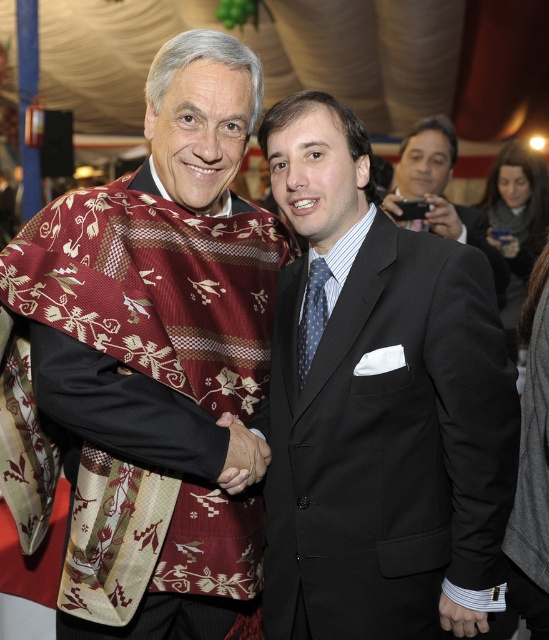
Based on the photo, you are an event photographer at the formal event. You need to capture a photo of the maroon woven shawl at center and the dark gray suit at center. Which one is located lower in the image?

The maroon woven shawl at center is positioned under dark gray suit at center, so it is located lower in the image.

You are a photographer standing at the camera position. You need to take a photo of the two people shaking hands. The focus point of your camera is set to point (x=238, y=433). Will this point be within the acceptable focus range of your camera, which requires the subject to be between 1.5 meters and 2 meters away?

The distance between point (x=238, y=433) and the camera is 1.78 meters, which falls within the required range of 1.5 to 2 meters. Therefore, the focus point at point (x=238, y=433) will be within the acceptable focus range.